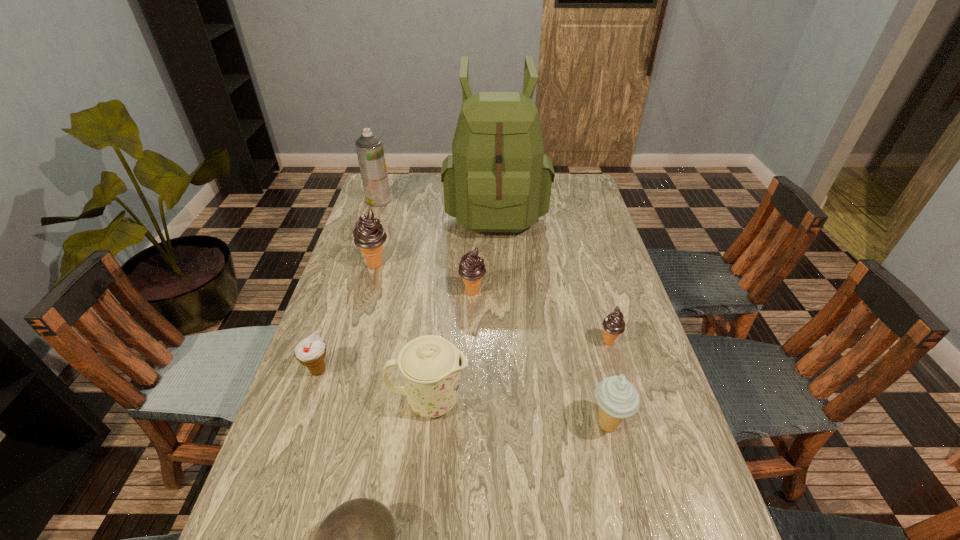
You are a GUI agent. You are given a task and a screenshot of the screen. Output one action in this format:
    pyautogui.click(x=<x>, y=<y>)
    Task: Click on the rightmost chocolate icecream
    
    Given the screenshot: What is the action you would take?
    pyautogui.click(x=613, y=325)

Locate an element on the screen. This screenshot has width=960, height=540. the fifth farthest object is located at coordinates (613, 325).

Where is `free region located on the front pocket of the backpack`? The height and width of the screenshot is (540, 960). free region located on the front pocket of the backpack is located at coordinates (498, 266).

The image size is (960, 540). Find the location of `blank space located on the front of the second tallest object`. blank space located on the front of the second tallest object is located at coordinates [362, 251].

The height and width of the screenshot is (540, 960). What are the coordinates of `free space located on the right of the biggest chocolate icecream` in the screenshot? It's located at (445, 264).

You are a GUI agent. You are given a task and a screenshot of the screen. Output one action in this format:
    pyautogui.click(x=<x>, y=<y>)
    Task: Click on the vacant space situated 0.290m on the spout of the chinaware
    This screenshot has width=960, height=540.
    Given the screenshot: What is the action you would take?
    pyautogui.click(x=589, y=400)

Locate an element on the screen. This screenshot has height=540, width=960. free space located on the front of the beige icecream is located at coordinates (630, 516).

Find the location of a particular element. Image resolution: width=960 pixels, height=540 pixels. vacant area situated on the back of the second chocolate icecream from left to right is located at coordinates (473, 254).

The image size is (960, 540). In order to click on vacant space positioned on the front of the second nearest icecream in this screenshot , I will do `click(278, 489)`.

Locate an element on the screen. Image resolution: width=960 pixels, height=540 pixels. vacant area situated on the left of the rightmost chocolate icecream is located at coordinates (559, 342).